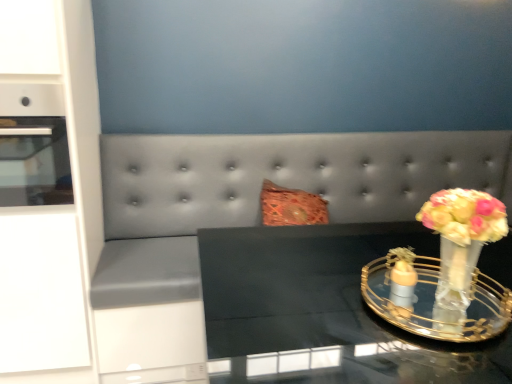
At what (x,y) coordinates should I click in order to perform the action: click on free space to the left of clear glass vase at right, which is counted as the first candle holder, starting from the right. Please return your answer as a coordinate pair (x, y). This screenshot has height=384, width=512. Looking at the image, I should click on (304, 305).